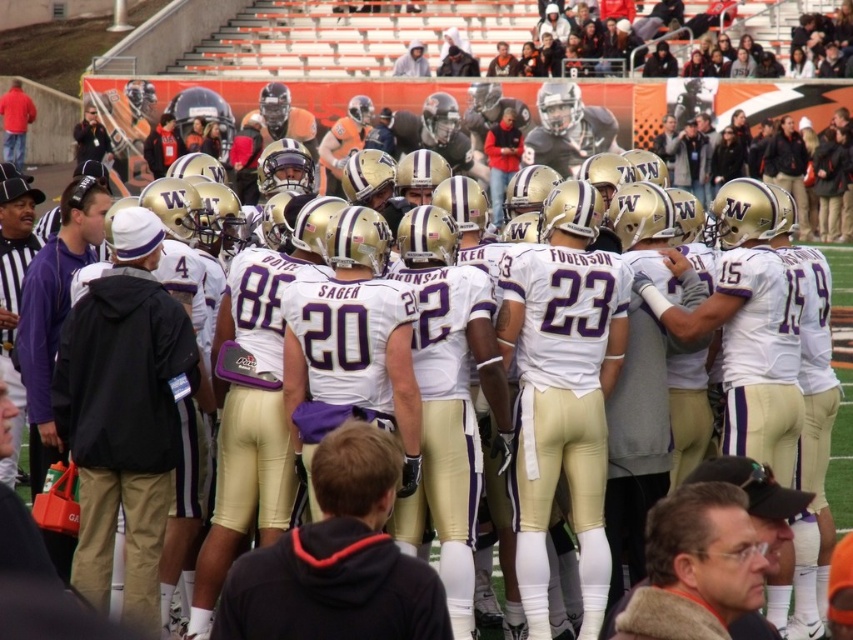
Question: Which point is closer to the camera taking this photo?

Choices:
 (A) (357, 552)
 (B) (56, 417)

Answer: (A)

Question: Is black fabric jacket at center smaller than black hoodie at center?

Choices:
 (A) no
 (B) yes

Answer: (B)

Question: Is black fabric jacket at center positioned in front of black hoodie at center?

Choices:
 (A) yes
 (B) no

Answer: (B)

Question: Does black fabric jacket at center have a lesser width compared to black hoodie at center?

Choices:
 (A) no
 (B) yes

Answer: (B)

Question: Which point appears farthest from the camera in this image?

Choices:
 (A) (103, 342)
 (B) (293, 632)

Answer: (A)

Question: Which point is farther from the camera taking this photo?

Choices:
 (A) (351, 536)
 (B) (103, 524)

Answer: (B)